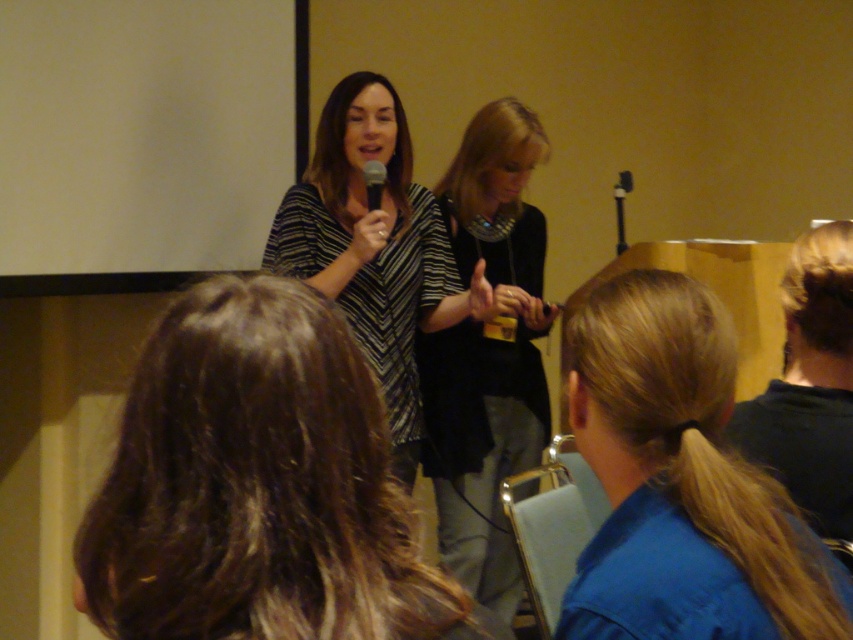
You are an attendee at this presentation and want to describe the presenter in the center. Which object, the brown wavy hair at center or the striped fabric dress at center, is wider?

The striped fabric dress at center is wider than the brown wavy hair at center.

You are sitting in the front row of the presentation and want to hand a note to the presenter. The presenter is the woman with the microphone. You have a 70 cm long pointer. Can you reach the blonde hair at lower right with the pointer?

The distance of blonde hair at lower right from viewer is 73.92 centimeters. Since the pointer is only 70 cm long, you cannot reach the blonde hair at lower right with the pointer.

From the picture: Based on the scene description, where is the brown wavy hair at center located in the image?

The brown wavy hair at center is located at point coordinates of (x=258, y=486).